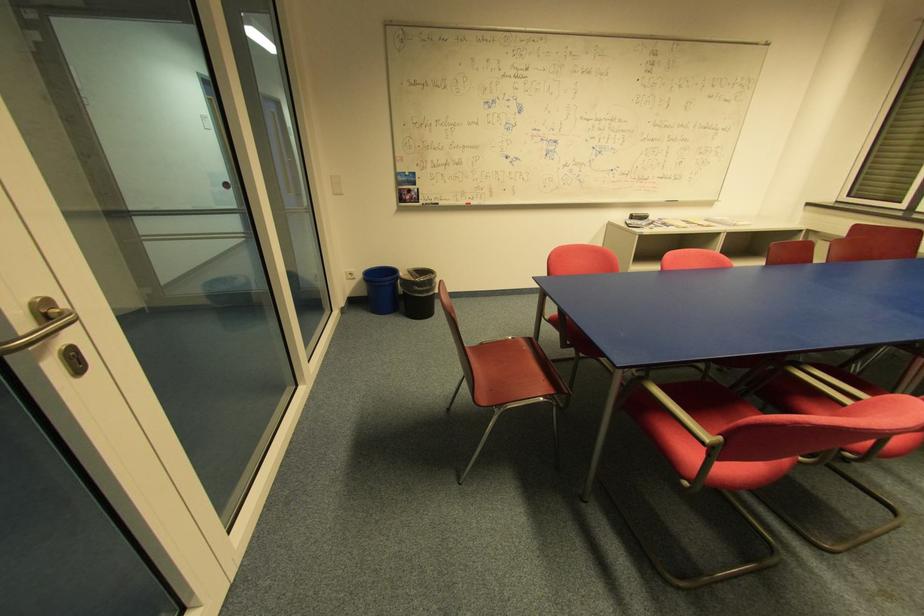
The width and height of the screenshot is (924, 616). Find the location of `silver door handle`. silver door handle is located at coordinates (41, 325).